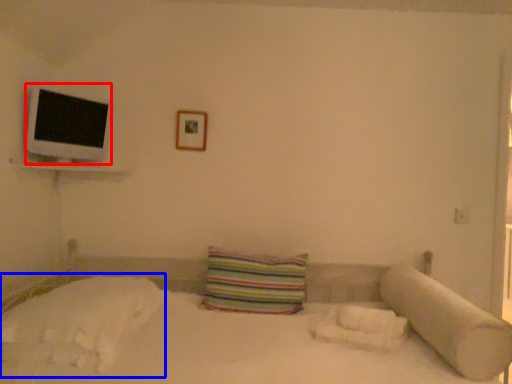
Question: Which point is closer to the camera, flat (highlighted by a red box) or sheet (highlighted by a blue box)?

Choices:
 (A) flat
 (B) sheet

Answer: (B)